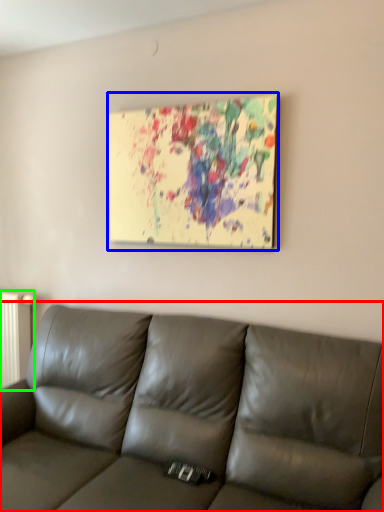
Question: Which object is the farthest from studio couch (highlighted by a red box)? Choose among these: picture frame (highlighted by a blue box) or radiator (highlighted by a green box).

Choices:
 (A) picture frame
 (B) radiator

Answer: (B)